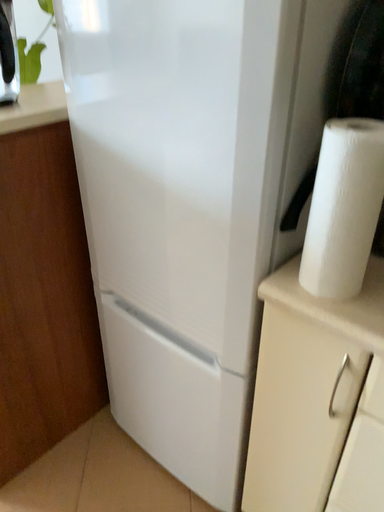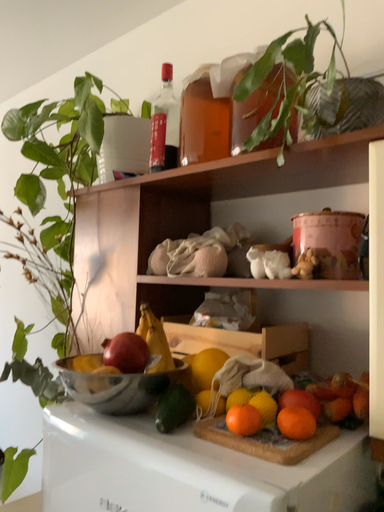
Question: Which way did the camera rotate in the video?

Choices:
 (A) rotated upward
 (B) rotated downward

Answer: (A)